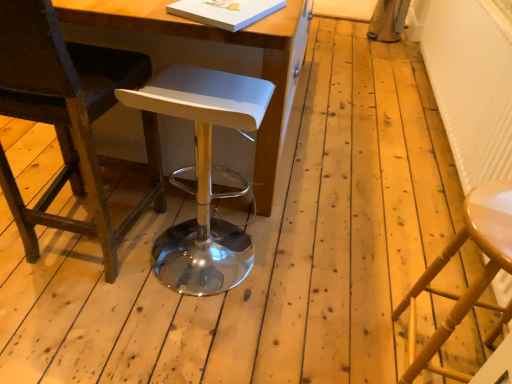
You are a GUI agent. You are given a task and a screenshot of the screen. Output one action in this format:
    pyautogui.click(x=<x>, y=<y>)
    Task: Click on the vacant area in front of dark brown leather chair at left
    The height and width of the screenshot is (384, 512).
    Given the screenshot: What is the action you would take?
    pyautogui.click(x=76, y=325)